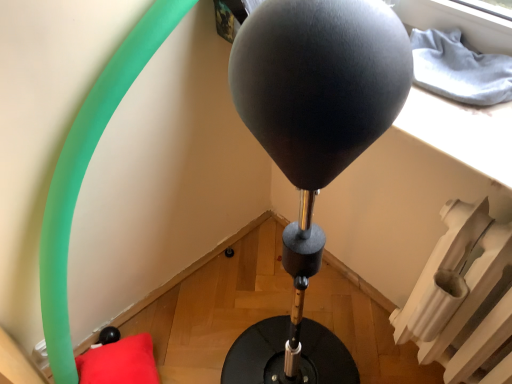
Identify the location of red plush pillow at lower left. (119, 362).

The width and height of the screenshot is (512, 384). What are the coordinates of `black matte balloon at center` in the screenshot? It's located at (319, 82).

Can red plush pillow at lower left be found inside black matte balloon at center?

No, red plush pillow at lower left is not surrounded by black matte balloon at center.

The image size is (512, 384). I want to click on pillow below the black matte balloon at center (from a real-world perspective), so click(x=119, y=362).

Measure the distance from black matte balloon at center to red plush pillow at lower left.

A distance of 3.62 feet exists between black matte balloon at center and red plush pillow at lower left.

From a real-world perspective, between black matte balloon at center and red plush pillow at lower left, who is vertically higher?

black matte balloon at center.

Based on their sizes in the image, would you say black matte balloon at center is bigger or smaller than white plastic radiator at lower right?

black matte balloon at center is smaller than white plastic radiator at lower right.

Can you confirm if black matte balloon at center is positioned to the left of white plastic radiator at lower right?

Yes.

Is black matte balloon at center facing towards white plastic radiator at lower right?

No, black matte balloon at center is not oriented towards white plastic radiator at lower right.

From a real-world perspective, is black matte balloon at center on top of white plastic radiator at lower right?

Yes, from a real-world perspective, black matte balloon at center is on top of white plastic radiator at lower right.

Does point (140, 336) lie behind point (485, 243)?

That is True.

Looking at this image, would you say red plush pillow at lower left is inside or outside white plastic radiator at lower right?

red plush pillow at lower left lies outside white plastic radiator at lower right.

Considering the sizes of objects red plush pillow at lower left and white plastic radiator at lower right in the image provided, who is thinner, red plush pillow at lower left or white plastic radiator at lower right?

With smaller width is white plastic radiator at lower right.

From a real-world perspective, who is located higher, red plush pillow at lower left or white plastic radiator at lower right?

white plastic radiator at lower right.

Looking at this image, from the image's perspective, which one is positioned higher, white plastic radiator at lower right or red plush pillow at lower left?

white plastic radiator at lower right, from the image's perspective.

Considering the relative positions of white plastic radiator at lower right and red plush pillow at lower left in the image provided, is white plastic radiator at lower right behind red plush pillow at lower left?

No, white plastic radiator at lower right is in front of red plush pillow at lower left.

Looking at their sizes, would you say white plastic radiator at lower right is wider or thinner than red plush pillow at lower left?

Clearly, white plastic radiator at lower right has less width compared to red plush pillow at lower left.

Can you confirm if white plastic radiator at lower right is bigger than red plush pillow at lower left?

Correct, white plastic radiator at lower right is larger in size than red plush pillow at lower left.

Does red plush pillow at lower left have a larger size compared to black matte balloon at center?

Actually, red plush pillow at lower left might be smaller than black matte balloon at center.

Does point (140, 366) appear closer or farther from the camera than point (362, 135)?

Point (140, 366).

Which is correct: red plush pillow at lower left is inside black matte balloon at center, or outside of it?

red plush pillow at lower left is located beyond the bounds of black matte balloon at center.

From the image's perspective, which is below, red plush pillow at lower left or black matte balloon at center?

red plush pillow at lower left appears lower in the image.

Measure the distance from white plastic radiator at lower right to black matte balloon at center.

The distance of white plastic radiator at lower right from black matte balloon at center is 25.57 inches.

Considering the relative positions of white plastic radiator at lower right and black matte balloon at center in the image provided, is white plastic radiator at lower right behind black matte balloon at center?

No, white plastic radiator at lower right is closer to the viewer.

Would you say white plastic radiator at lower right contains black matte balloon at center?

Actually, black matte balloon at center is outside white plastic radiator at lower right.

Would you say white plastic radiator at lower right is a long distance from black matte balloon at center?

They are positioned close to each other.

Find the location of a particular element. Image resolution: width=512 pixels, height=384 pixels. pillow that appears on the left of black matte balloon at center is located at coordinates (119, 362).

Where is `radiator lying on the right of black matte balloon at center`? Image resolution: width=512 pixels, height=384 pixels. radiator lying on the right of black matte balloon at center is located at coordinates (461, 297).

Looking at this image, estimate the real-world distances between objects in this image. Which object is further from red plush pillow at lower left, black matte balloon at center or white plastic radiator at lower right?

black matte balloon at center is further to red plush pillow at lower left.

Looking at the image, which one is located closer to red plush pillow at lower left, white plastic radiator at lower right or black matte balloon at center?

white plastic radiator at lower right is closer to red plush pillow at lower left.

Based on the photo, from the image, which object appears to be farther from white plastic radiator at lower right, red plush pillow at lower left or black matte balloon at center?

red plush pillow at lower left is further to white plastic radiator at lower right.

Which object lies further to the anchor point black matte balloon at center, white plastic radiator at lower right or red plush pillow at lower left?

Among the two, red plush pillow at lower left is located further to black matte balloon at center.

Which object lies further to the anchor point black matte balloon at center, red plush pillow at lower left or white plastic radiator at lower right?

red plush pillow at lower left is further to black matte balloon at center.

Based on their spatial positions, is black matte balloon at center or red plush pillow at lower left further from white plastic radiator at lower right?

red plush pillow at lower left is further to white plastic radiator at lower right.

Identify the location of balloon between red plush pillow at lower left and white plastic radiator at lower right in the horizontal direction. (319, 82).